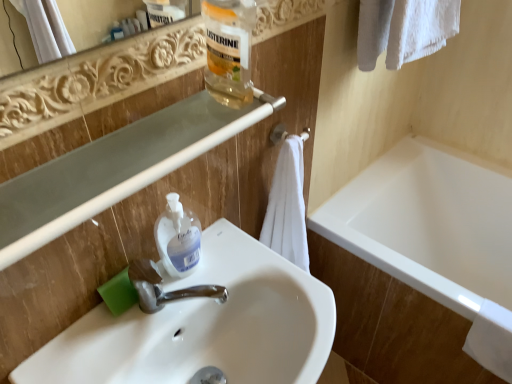
Question: Is white glossy bathtub at lower right shorter than white soft towel at center?

Choices:
 (A) yes
 (B) no

Answer: (B)

Question: Is white glossy bathtub at lower right smaller than white soft towel at center?

Choices:
 (A) yes
 (B) no

Answer: (B)

Question: Considering the relative sizes of white glossy bathtub at lower right and white soft towel at center in the image provided, is white glossy bathtub at lower right thinner than white soft towel at center?

Choices:
 (A) no
 (B) yes

Answer: (A)

Question: Is white glossy bathtub at lower right far from white soft towel at center?

Choices:
 (A) no
 (B) yes

Answer: (A)

Question: From the image's perspective, is white glossy bathtub at lower right on top of white soft towel at center?

Choices:
 (A) yes
 (B) no

Answer: (B)

Question: Is white glossy bathtub at lower right located outside white soft towel at center?

Choices:
 (A) no
 (B) yes

Answer: (B)

Question: Can you confirm if clear plastic balustrade at upper center is positioned to the right of white matte towel bar at center?

Choices:
 (A) yes
 (B) no

Answer: (B)

Question: Is clear plastic balustrade at upper center taller than white matte towel bar at center?

Choices:
 (A) no
 (B) yes

Answer: (B)

Question: From a real-world perspective, is clear plastic balustrade at upper center positioned under white matte towel bar at center based on gravity?

Choices:
 (A) yes
 (B) no

Answer: (B)

Question: Is clear plastic balustrade at upper center at the left side of white matte towel bar at center?

Choices:
 (A) no
 (B) yes

Answer: (B)

Question: Considering the relative positions of clear plastic balustrade at upper center and white matte towel bar at center in the image provided, is clear plastic balustrade at upper center behind white matte towel bar at center?

Choices:
 (A) yes
 (B) no

Answer: (B)

Question: Is clear plastic balustrade at upper center positioned beyond the bounds of white matte towel bar at center?

Choices:
 (A) yes
 (B) no

Answer: (A)

Question: Is white matte towel bar at center wider than translucent plastic bottle at upper center?

Choices:
 (A) yes
 (B) no

Answer: (A)